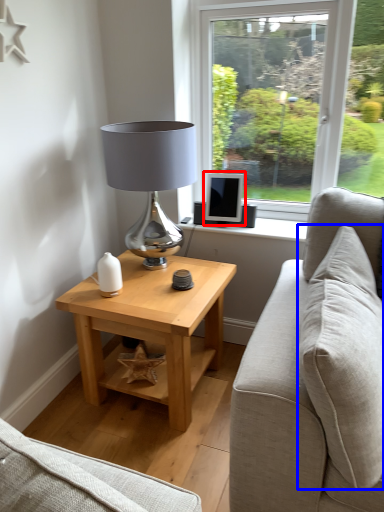
Question: Which object appears closest to the camera in this image, computer monitor (highlighted by a red box) or pillow (highlighted by a blue box)?

Choices:
 (A) computer monitor
 (B) pillow

Answer: (B)